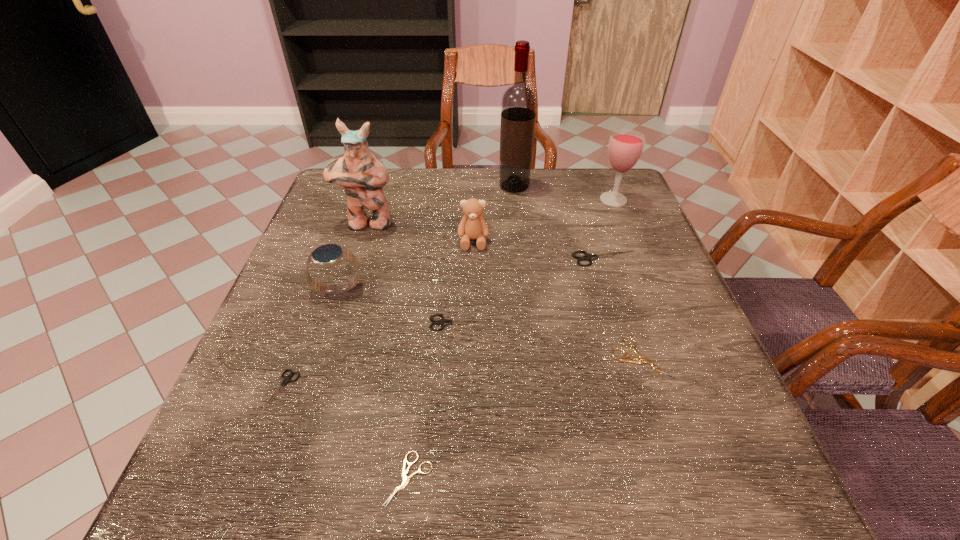
What are the coordinates of `free space that is in between the wineglass and the farther beige shears` in the screenshot? It's located at (627, 279).

Where is `object identified as the ninth closest to the farther beige shears`? This screenshot has width=960, height=540. object identified as the ninth closest to the farther beige shears is located at coordinates pyautogui.click(x=287, y=379).

Locate an element on the screen. object identified as the second closest to the farthest black shears is located at coordinates (473, 226).

Where is `the second closest shears to the seventh object from left to right`? the second closest shears to the seventh object from left to right is located at coordinates (443, 322).

You are a GUI agent. You are given a task and a screenshot of the screen. Output one action in this format:
    pyautogui.click(x=<x>, y=<y>)
    Task: Click on the shears that is the closest one to the second smallest black shears
    The height and width of the screenshot is (540, 960).
    Given the screenshot: What is the action you would take?
    pyautogui.click(x=642, y=359)

Point out which black shears is positioned as the third nearest to the third tallest object. Please provide its 2D coordinates. Your answer should be formatted as a tuple, i.e. [(x, y)], where the tuple contains the x and y coordinates of a point satisfying the conditions above.

[(287, 379)]

Identify which black shears is located as the third nearest to the wineglass. Please provide its 2D coordinates. Your answer should be formatted as a tuple, i.e. [(x, y)], where the tuple contains the x and y coordinates of a point satisfying the conditions above.

[(287, 379)]

Find the location of `free spot that satisfies the following two spatial constraints: 1. on the front side of the second tallest shears; 2. on the left side of the right beige shears`. free spot that satisfies the following two spatial constraints: 1. on the front side of the second tallest shears; 2. on the left side of the right beige shears is located at coordinates (458, 359).

Find the location of a particular element. The height and width of the screenshot is (540, 960). free location that satisfies the following two spatial constraints: 1. on the front-facing side of the farthest black shears; 2. on the right side of the pink figurine is located at coordinates (356, 259).

Identify the location of free spot that satisfies the following two spatial constraints: 1. on the front-facing side of the figurine; 2. on the right side of the second farthest shears. The height and width of the screenshot is (540, 960). (335, 323).